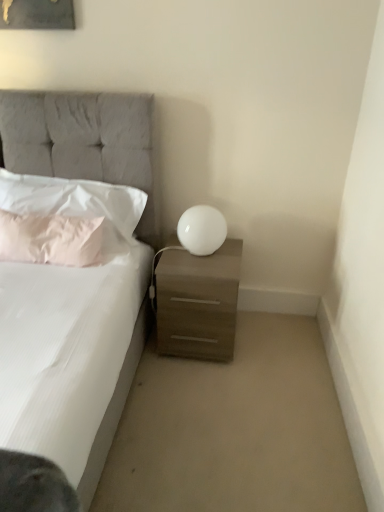
Question: Is white glossy sphere at right in front of or behind matte wood nightstand at lower right in the image?

Choices:
 (A) front
 (B) behind

Answer: (B)

Question: Based on their positions, is white glossy sphere at right located to the left or right of matte wood nightstand at lower right?

Choices:
 (A) left
 (B) right

Answer: (B)

Question: Which object is positioned closest to the tufted fabric bed at upper left?

Choices:
 (A) white glossy sphere at right
 (B) white fabric pillow at left, which ranks as the 1th pillow in top-to-bottom order
 (C) pink fabric pillow at left, positioned as the 1th pillow in bottom-to-top order
 (D) matte wood nightstand at lower right

Answer: (B)

Question: Which of these objects is positioned farthest from the pink fabric pillow at left, arranged as the second pillow when viewed from the top?

Choices:
 (A) white glossy sphere at right
 (B) matte wood nightstand at lower right
 (C) tufted fabric bed at upper left
 (D) white fabric pillow at left, positioned as the 2th pillow in bottom-to-top order

Answer: (A)